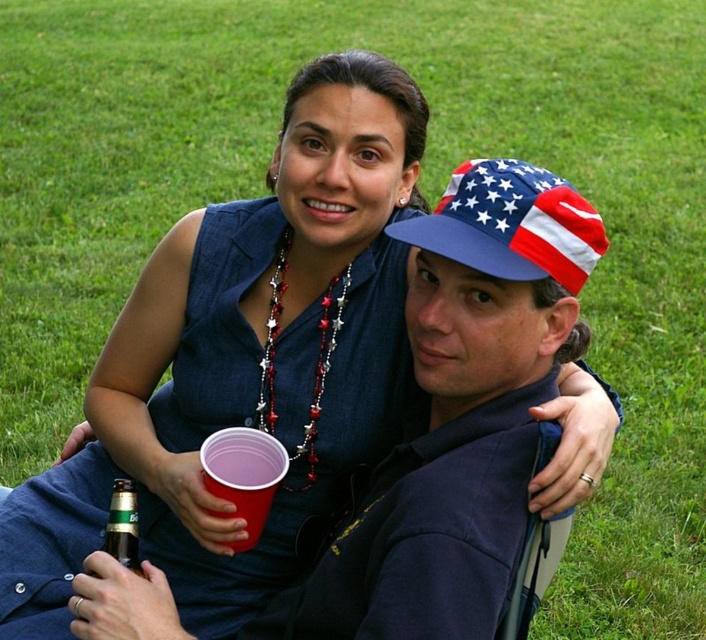
Question: From the image, what is the correct spatial relationship of american flag fabric cap at upper right in relation to green matte bottle at lower left?

Choices:
 (A) above
 (B) below

Answer: (A)

Question: Can you confirm if american flag fabric cap at upper right is positioned below green matte bottle at lower left?

Choices:
 (A) no
 (B) yes

Answer: (A)

Question: Which of the following is the closest to the observer?

Choices:
 (A) (133, 538)
 (B) (479, 244)

Answer: (B)

Question: Does american flag fabric cap at upper right come in front of green matte bottle at lower left?

Choices:
 (A) yes
 (B) no

Answer: (A)